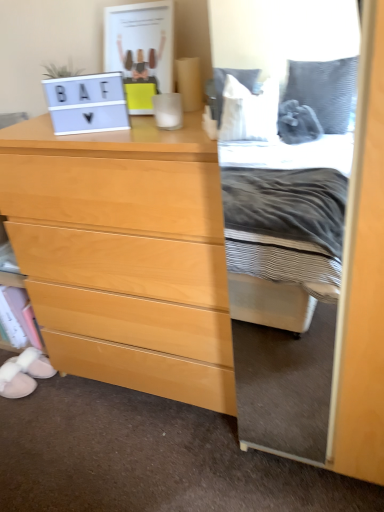
How much space does white fluffy slippers at lower left, positioned as the first shoe in back-to-front order, occupy vertically?

white fluffy slippers at lower left, positioned as the first shoe in back-to-front order, is 4.02 inches in height.

Locate an element on the screen. The width and height of the screenshot is (384, 512). matte white laptop at upper left is located at coordinates (87, 103).

Where is `light wood chest of drawers at left`? light wood chest of drawers at left is located at coordinates (124, 254).

At what (x,y) coordinates should I click in order to perform the action: click on white fluffy slippers at lower left, acting as the 2th shoe starting from the front. Please return your answer as a coordinate pair (x, y). Looking at the image, I should click on (34, 362).

In the image, is white suede slipper at lower left, acting as the first shoe starting from the front, positioned in front of or behind white fluffy slippers at lower left, acting as the 2th shoe starting from the front?

white suede slipper at lower left, acting as the first shoe starting from the front, is positioned closer to the viewer than white fluffy slippers at lower left, acting as the 2th shoe starting from the front.

Considering the relative sizes of white suede slipper at lower left, which is the second shoe from back to front, and white fluffy slippers at lower left, positioned as the first shoe in back-to-front order, in the image provided, is white suede slipper at lower left, which is the second shoe from back to front, smaller than white fluffy slippers at lower left, positioned as the first shoe in back-to-front order,?

Incorrect, white suede slipper at lower left, which is the second shoe from back to front, is not smaller in size than white fluffy slippers at lower left, positioned as the first shoe in back-to-front order.

Where is `shoe on the right of white suede slipper at lower left, acting as the first shoe starting from the front`? The height and width of the screenshot is (512, 384). shoe on the right of white suede slipper at lower left, acting as the first shoe starting from the front is located at coordinates (34, 362).

In the scene shown: Can we say white suede slipper at lower left, which is the second shoe from back to front, lies outside white fluffy slippers at lower left, positioned as the first shoe in back-to-front order?

Yes, white suede slipper at lower left, which is the second shoe from back to front, is not within white fluffy slippers at lower left, positioned as the first shoe in back-to-front order.

From a real-world perspective, is matte white laptop at upper left over light wood chest of drawers at left?

Correct, in the physical world, matte white laptop at upper left is higher than light wood chest of drawers at left.

Is light wood chest of drawers at left located within matte white laptop at upper left?

No, light wood chest of drawers at left is not inside matte white laptop at upper left.

Considering the relative sizes of matte white laptop at upper left and light wood chest of drawers at left in the image provided, is matte white laptop at upper left smaller than light wood chest of drawers at left?

Correct, matte white laptop at upper left occupies less space than light wood chest of drawers at left.

Is white suede slipper at lower left, which is the second shoe from back to front, looking in the opposite direction of light wood chest of drawers at left?

No.

Can you confirm if white suede slipper at lower left, which is the second shoe from back to front, is thinner than light wood chest of drawers at left?

Yes.

Which object is closer to the camera taking this photo, white suede slipper at lower left, which is the second shoe from back to front, or light wood chest of drawers at left?

Positioned in front is light wood chest of drawers at left.

Identify the location of the 1st shoe behind the light wood chest of drawers at left. (15, 381).

From the picture: From the image's perspective, which is above, matte white laptop at upper left or white fluffy slippers at lower left, acting as the 2th shoe starting from the front?

matte white laptop at upper left appears higher in the image.

Is white fluffy slippers at lower left, positioned as the first shoe in back-to-front order, surrounded by matte white laptop at upper left?

No, white fluffy slippers at lower left, positioned as the first shoe in back-to-front order, is not a part of matte white laptop at upper left.

Does matte white laptop at upper left turn towards white fluffy slippers at lower left, acting as the 2th shoe starting from the front?

No, matte white laptop at upper left is not facing towards white fluffy slippers at lower left, acting as the 2th shoe starting from the front.

How much distance is there between matte white laptop at upper left and white suede slipper at lower left, acting as the first shoe starting from the front?

The distance of matte white laptop at upper left from white suede slipper at lower left, acting as the first shoe starting from the front, is 1.10 meters.

Is matte white laptop at upper left not within white suede slipper at lower left, acting as the first shoe starting from the front?

Yes, matte white laptop at upper left is outside of white suede slipper at lower left, acting as the first shoe starting from the front.

Considering the relative sizes of matte white laptop at upper left and white suede slipper at lower left, acting as the first shoe starting from the front, in the image provided, is matte white laptop at upper left shorter than white suede slipper at lower left, acting as the first shoe starting from the front,?

No.

Which point is more forward, (26, 357) or (22, 391)?

The point (22, 391) is closer to the camera.

In terms of size, does white fluffy slippers at lower left, positioned as the first shoe in back-to-front order, appear bigger or smaller than white suede slipper at lower left, which is the second shoe from back to front?

Clearly, white fluffy slippers at lower left, positioned as the first shoe in back-to-front order, is smaller in size than white suede slipper at lower left, which is the second shoe from back to front.

From the image's perspective, which is below, white fluffy slippers at lower left, positioned as the first shoe in back-to-front order, or white suede slipper at lower left, acting as the first shoe starting from the front?

white suede slipper at lower left, acting as the first shoe starting from the front, is shown below in the image.

Is white fluffy slippers at lower left, positioned as the first shoe in back-to-front order, next to white suede slipper at lower left, which is the second shoe from back to front, and touching it?

Yes, white fluffy slippers at lower left, positioned as the first shoe in back-to-front order, is in contact with white suede slipper at lower left, which is the second shoe from back to front.

Can you confirm if light wood chest of drawers at left is wider than white fluffy slippers at lower left, acting as the 2th shoe starting from the front?

Correct, the width of light wood chest of drawers at left exceeds that of white fluffy slippers at lower left, acting as the 2th shoe starting from the front.

Is light wood chest of drawers at left not near white fluffy slippers at lower left, positioned as the first shoe in back-to-front order?

That's not correct — light wood chest of drawers at left is a little close to white fluffy slippers at lower left, positioned as the first shoe in back-to-front order.

Considering the sizes of objects light wood chest of drawers at left and white fluffy slippers at lower left, acting as the 2th shoe starting from the front, in the image provided, who is bigger, light wood chest of drawers at left or white fluffy slippers at lower left, acting as the 2th shoe starting from the front,?

light wood chest of drawers at left.

Is light wood chest of drawers at left shorter than white fluffy slippers at lower left, positioned as the first shoe in back-to-front order?

In fact, light wood chest of drawers at left may be taller than white fluffy slippers at lower left, positioned as the first shoe in back-to-front order.

Where is `shoe that is on the left side of white fluffy slippers at lower left, acting as the 2th shoe starting from the front`? The width and height of the screenshot is (384, 512). shoe that is on the left side of white fluffy slippers at lower left, acting as the 2th shoe starting from the front is located at coordinates (15, 381).

You are a GUI agent. You are given a task and a screenshot of the screen. Output one action in this format:
    pyautogui.click(x=<x>, y=<y>)
    Task: Click on the laptop lying behind the light wood chest of drawers at left
    
    Given the screenshot: What is the action you would take?
    87,103

Looking at the image, which one is located further to white suede slipper at lower left, which is the second shoe from back to front, matte white laptop at upper left or light wood chest of drawers at left?

The object further to white suede slipper at lower left, which is the second shoe from back to front, is matte white laptop at upper left.

Which object lies nearer to the anchor point light wood chest of drawers at left, white fluffy slippers at lower left, positioned as the first shoe in back-to-front order, or matte white laptop at upper left?

matte white laptop at upper left is closer to light wood chest of drawers at left.

From the image, which object appears to be farther from matte white laptop at upper left, white suede slipper at lower left, which is the second shoe from back to front, or white fluffy slippers at lower left, acting as the 2th shoe starting from the front?

The object further to matte white laptop at upper left is white suede slipper at lower left, which is the second shoe from back to front.

Based on their spatial positions, is matte white laptop at upper left or light wood chest of drawers at left further from white fluffy slippers at lower left, positioned as the first shoe in back-to-front order?

matte white laptop at upper left is positioned further to the anchor white fluffy slippers at lower left, positioned as the first shoe in back-to-front order.

Estimate the real-world distances between objects in this image. Which object is further from white fluffy slippers at lower left, positioned as the first shoe in back-to-front order, white suede slipper at lower left, which is the second shoe from back to front, or light wood chest of drawers at left?

light wood chest of drawers at left is further to white fluffy slippers at lower left, positioned as the first shoe in back-to-front order.

Looking at the image, which one is located closer to matte white laptop at upper left, white fluffy slippers at lower left, acting as the 2th shoe starting from the front, or white suede slipper at lower left, which is the second shoe from back to front?

white fluffy slippers at lower left, acting as the 2th shoe starting from the front, is positioned closer to the anchor matte white laptop at upper left.

Considering their positions, is light wood chest of drawers at left positioned closer to white suede slipper at lower left, acting as the first shoe starting from the front, than white fluffy slippers at lower left, positioned as the first shoe in back-to-front order?

Among the two, white fluffy slippers at lower left, positioned as the first shoe in back-to-front order, is located nearer to white suede slipper at lower left, acting as the first shoe starting from the front.

Based on their spatial positions, is light wood chest of drawers at left or matte white laptop at upper left closer to white suede slipper at lower left, which is the second shoe from back to front?

The object closer to white suede slipper at lower left, which is the second shoe from back to front, is light wood chest of drawers at left.

Find the location of a particular element. shoe positioned between light wood chest of drawers at left and white fluffy slippers at lower left, acting as the 2th shoe starting from the front, from near to far is located at coordinates (15, 381).

The width and height of the screenshot is (384, 512). Find the location of `shoe between matte white laptop at upper left and white suede slipper at lower left, which is the second shoe from back to front, vertically`. shoe between matte white laptop at upper left and white suede slipper at lower left, which is the second shoe from back to front, vertically is located at coordinates (34, 362).

Identify the location of chest of drawers between matte white laptop at upper left and white fluffy slippers at lower left, positioned as the first shoe in back-to-front order, in the up-down direction. The height and width of the screenshot is (512, 384). (124, 254).

This screenshot has width=384, height=512. What are the coordinates of `the chest of drawers that lies between matte white laptop at upper left and white suede slipper at lower left, acting as the first shoe starting from the front, from top to bottom` in the screenshot? It's located at (124, 254).